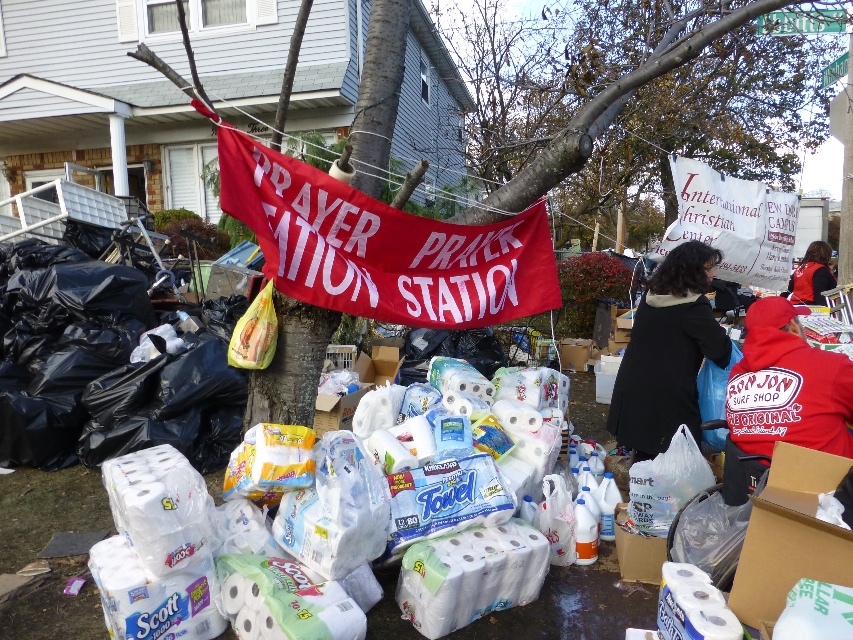
Question: In this image, where is red fabric banner at center located relative to red hoodie at lower right?

Choices:
 (A) right
 (B) left

Answer: (B)

Question: Which object is closer to the camera taking this photo?

Choices:
 (A) white matte toilet paper at center
 (B) white matte scott toilet paper at lower center

Answer: (B)

Question: Can you confirm if black plastic bags at left is smaller than smooth bark tree at center?

Choices:
 (A) no
 (B) yes

Answer: (B)

Question: Does brown cardboard box at lower right come in front of white matte scott toilet paper at lower center?

Choices:
 (A) yes
 (B) no

Answer: (A)

Question: Based on their relative distances, which object is farther from the white matte toilet paper at center?

Choices:
 (A) smooth bark tree at center
 (B) red hoodie at lower right

Answer: (A)

Question: Among these objects, which one is farthest from the camera?

Choices:
 (A) white matte scott toilet paper at lower center
 (B) red cotton vest at center

Answer: (B)